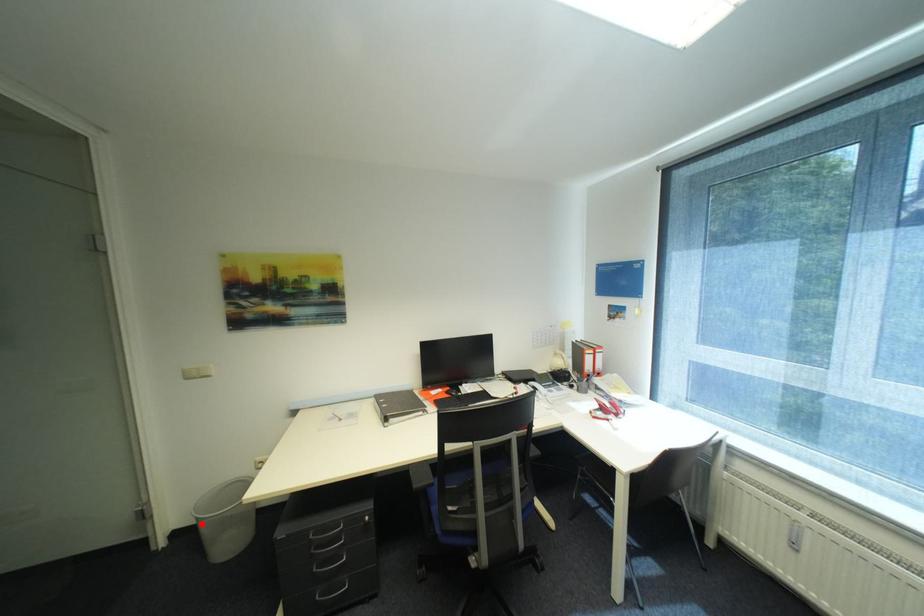
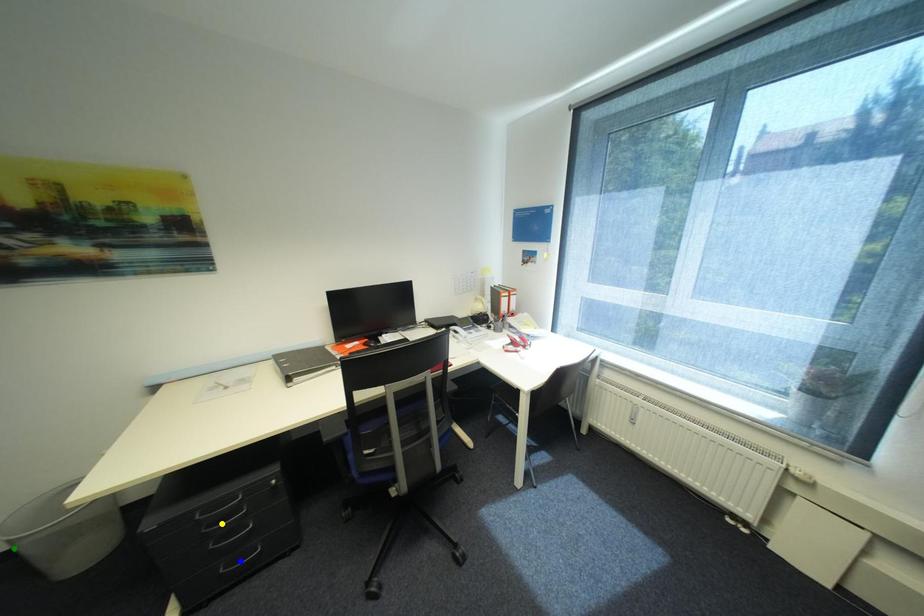
Question: I am providing you with two images of the same scene from different viewpoints. A red point is marked on the first image. You are given multiple points on the second image. Which point in image 2 represents the same 3d spot as the red point in image 1?

Choices:
 (A) green point
 (B) blue point
 (C) yellow point

Answer: (A)